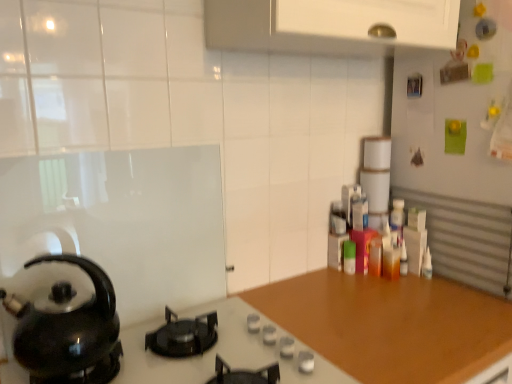
Question: Is wooden at center placed right next to black glossy kettle at left?

Choices:
 (A) no
 (B) yes

Answer: (A)

Question: Is wooden at center taller than black glossy kettle at left?

Choices:
 (A) no
 (B) yes

Answer: (B)

Question: From the image's perspective, is wooden at center below black glossy kettle at left?

Choices:
 (A) no
 (B) yes

Answer: (B)

Question: Does wooden at center appear on the left side of black glossy kettle at left?

Choices:
 (A) no
 (B) yes

Answer: (A)

Question: Is the position of wooden at center less distant than that of black glossy kettle at left?

Choices:
 (A) no
 (B) yes

Answer: (A)

Question: In terms of width, does black glossy kettle at left look wider or thinner when compared to black matte gas stove at center?

Choices:
 (A) wide
 (B) thin

Answer: (B)

Question: Considering the positions of point (83, 354) and point (356, 380), is point (83, 354) closer or farther from the camera than point (356, 380)?

Choices:
 (A) farther
 (B) closer

Answer: (B)

Question: Based on their sizes in the image, would you say black glossy kettle at left is bigger or smaller than black matte gas stove at center?

Choices:
 (A) small
 (B) big

Answer: (A)

Question: Based on their positions, is black glossy kettle at left located to the left or right of black matte gas stove at center?

Choices:
 (A) left
 (B) right

Answer: (A)

Question: Would you say black matte gas stove at center is to the left or to the right of black glossy kettle at left in the picture?

Choices:
 (A) right
 (B) left

Answer: (A)

Question: From a real-world perspective, is black matte gas stove at center positioned above or below black glossy kettle at left?

Choices:
 (A) below
 (B) above

Answer: (A)

Question: From the image's perspective, is black matte gas stove at center above or below black glossy kettle at left?

Choices:
 (A) above
 (B) below

Answer: (B)

Question: Is point (240, 357) positioned closer to the camera than point (82, 352)?

Choices:
 (A) closer
 (B) farther

Answer: (B)

Question: Is wooden at center in front of or behind black matte gas stove at center in the image?

Choices:
 (A) front
 (B) behind

Answer: (B)

Question: Considering the positions of wooden at center and black matte gas stove at center in the image, is wooden at center bigger or smaller than black matte gas stove at center?

Choices:
 (A) big
 (B) small

Answer: (A)